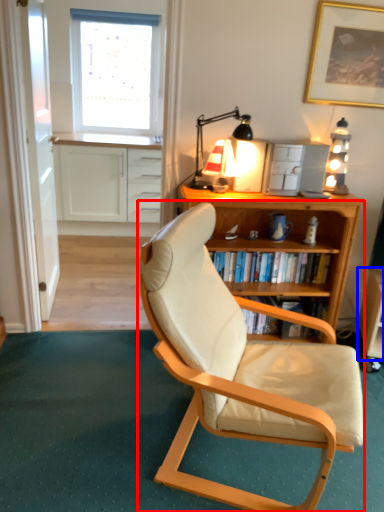
Question: Which of the following is the closest to the observer, chair (highlighted by a red box) or table (highlighted by a blue box)?

Choices:
 (A) chair
 (B) table

Answer: (A)